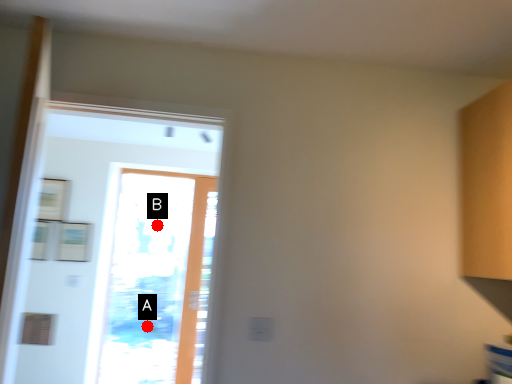
Question: Two points are circled on the image, labeled by A and B beside each circle. Which point is closer to the camera?

Choices:
 (A) A is closer
 (B) B is closer

Answer: (A)